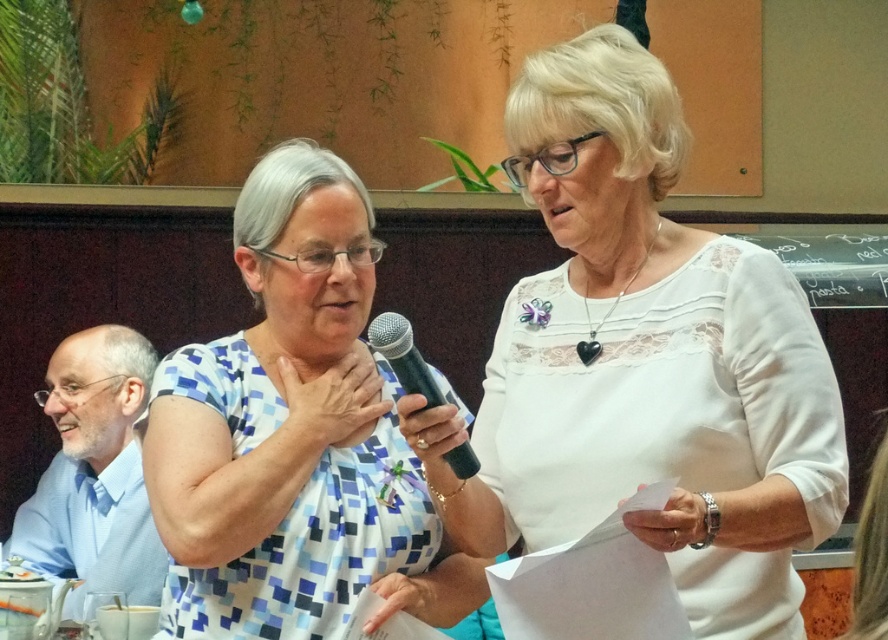
You are organizing a photo album and want to place the white lace blouse at upper center and the blue shirt at left side by side. Which one requires more horizontal space?

The white lace blouse at upper center requires more horizontal space because its width is larger than the blue shirt at left.

Where is the white lace blouse at upper center located in the image?

The white lace blouse at upper center is located at point (643, 362) in the image.

You are a photographer at the event and need to capture a closeup of the white lace blouse at upper center. The camera requires a minimum distance of 5 feet to focus properly. Can you use the camera from your current position?

The white lace blouse at upper center and camera are 5.39 feet apart, which is more than the required 5 feet, so yes, you can use the camera from your current position to capture the closeup.